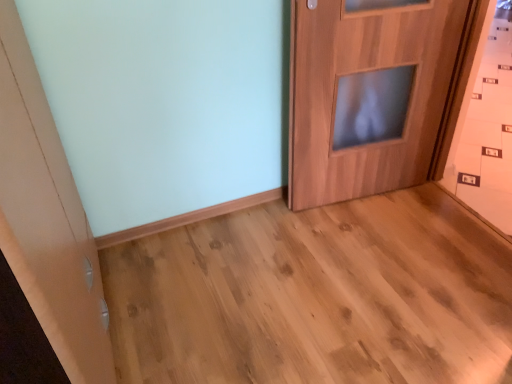
Question: Considering the relative sizes of natural wood floor at center and wooden door at center in the image provided, is natural wood floor at center taller than wooden door at center?

Choices:
 (A) yes
 (B) no

Answer: (B)

Question: Is natural wood floor at center positioned far away from wooden door at center?

Choices:
 (A) yes
 (B) no

Answer: (B)

Question: From the image's perspective, is natural wood floor at center on top of wooden door at center?

Choices:
 (A) no
 (B) yes

Answer: (A)

Question: Can you confirm if natural wood floor at center is bigger than wooden door at center?

Choices:
 (A) no
 (B) yes

Answer: (B)

Question: Does natural wood floor at center appear on the left side of wooden door at center?

Choices:
 (A) yes
 (B) no

Answer: (A)

Question: Can you confirm if natural wood floor at center is smaller than wooden door at center?

Choices:
 (A) no
 (B) yes

Answer: (A)

Question: Is wooden door at center smaller than natural wood floor at center?

Choices:
 (A) no
 (B) yes

Answer: (B)

Question: Is wooden door at center next to natural wood floor at center?

Choices:
 (A) no
 (B) yes

Answer: (A)

Question: Is wooden door at center oriented away from natural wood floor at center?

Choices:
 (A) yes
 (B) no

Answer: (B)

Question: From a real-world perspective, does wooden door at center sit lower than natural wood floor at center?

Choices:
 (A) no
 (B) yes

Answer: (A)

Question: From the image's perspective, is wooden door at center on top of natural wood floor at center?

Choices:
 (A) no
 (B) yes

Answer: (B)

Question: Would you say wooden door at center is a long distance from natural wood floor at center?

Choices:
 (A) no
 (B) yes

Answer: (A)

Question: From the image's perspective, is natural wood floor at center above or below wooden door at center?

Choices:
 (A) above
 (B) below

Answer: (B)